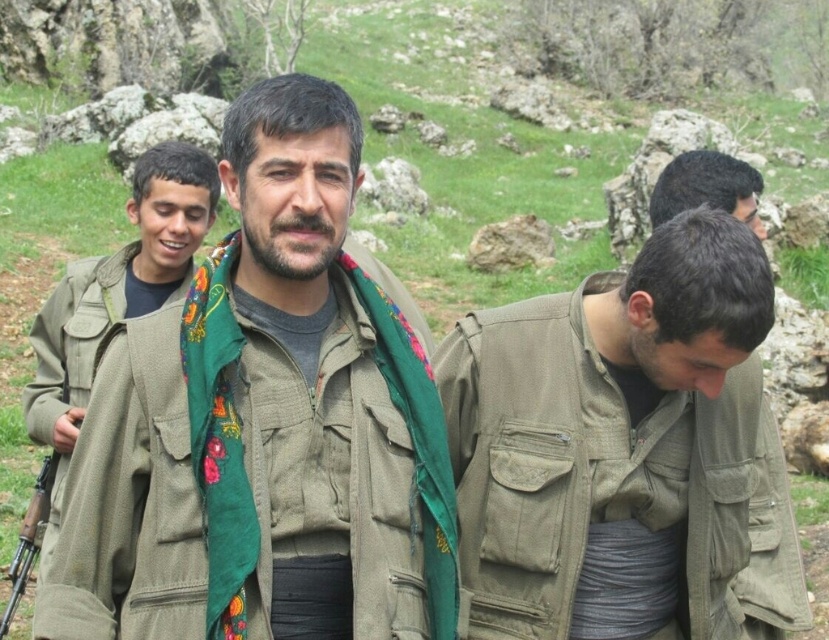
Which is in front, point (154, 442) or point (139, 280)?

Point (154, 442) is in front.

Is point (154, 477) positioned before point (142, 195)?

Yes, it is.

What do you see at coordinates (168, 483) in the screenshot? I see `khaki fabric jacket at center` at bounding box center [168, 483].

This screenshot has height=640, width=829. In order to click on khaki fabric jacket at center in this screenshot , I will do `click(168, 483)`.

Who is more distant from viewer, (207, 173) or (696, 172)?

The point (207, 173) is behind.

Is matte green jacket at left below green fabric scarf at center?

No.

Locate an element on the screen. Image resolution: width=829 pixels, height=640 pixels. matte green jacket at left is located at coordinates click(115, 294).

Between point (361, 616) and point (748, 166), which one is positioned in front?

Point (361, 616) is more forward.

What do you see at coordinates (168, 483) in the screenshot?
I see `khaki fabric jacket at center` at bounding box center [168, 483].

At what (x,y) coordinates should I click in order to perform the action: click on khaki fabric jacket at center. Please return your answer as a coordinate pair (x, y). This screenshot has width=829, height=640. Looking at the image, I should click on coord(168,483).